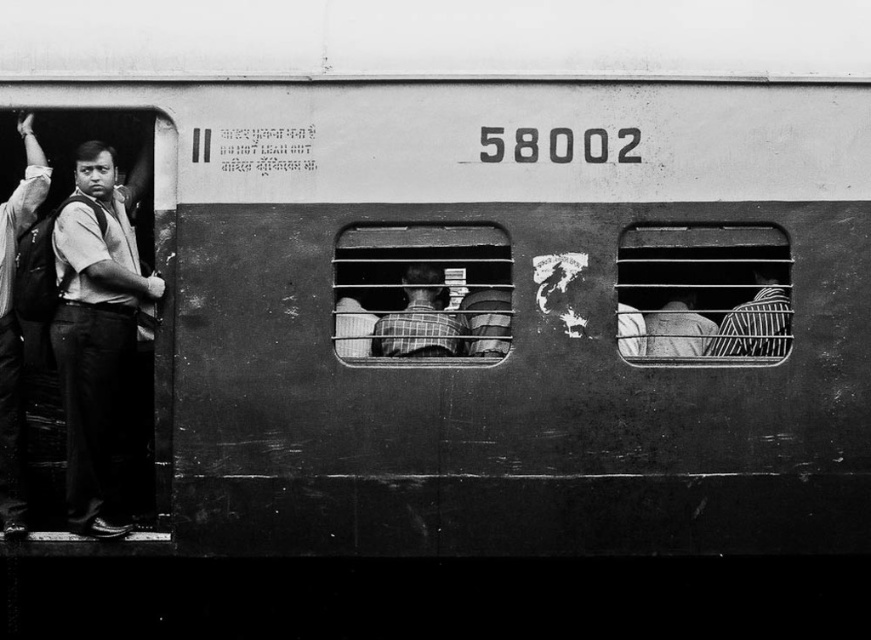
Does metallic grid at right have a greater width compared to striped shirt at center?

Correct, the width of metallic grid at right exceeds that of striped shirt at center.

The width and height of the screenshot is (871, 640). I want to click on metallic grid at right, so click(x=704, y=294).

The width and height of the screenshot is (871, 640). In order to click on metallic grid at right in this screenshot , I will do `click(704, 294)`.

Between point (390, 305) and point (780, 278), which one is positioned in front?

Point (780, 278) is in front.

Who is higher up, metallic grid train window at center or striped fabric shirt at right?

metallic grid train window at center is higher up.

Describe the element at coordinates (422, 292) in the screenshot. Image resolution: width=871 pixels, height=640 pixels. I see `metallic grid train window at center` at that location.

What are the coordinates of `metallic grid train window at center` in the screenshot? It's located at (422, 292).

Is point (5, 396) closer to camera compared to point (395, 333)?

No.

Image resolution: width=871 pixels, height=640 pixels. What are the coordinates of `matte black backpack at left` in the screenshot? It's located at (15, 324).

The width and height of the screenshot is (871, 640). Identify the location of matte black backpack at left. (15, 324).